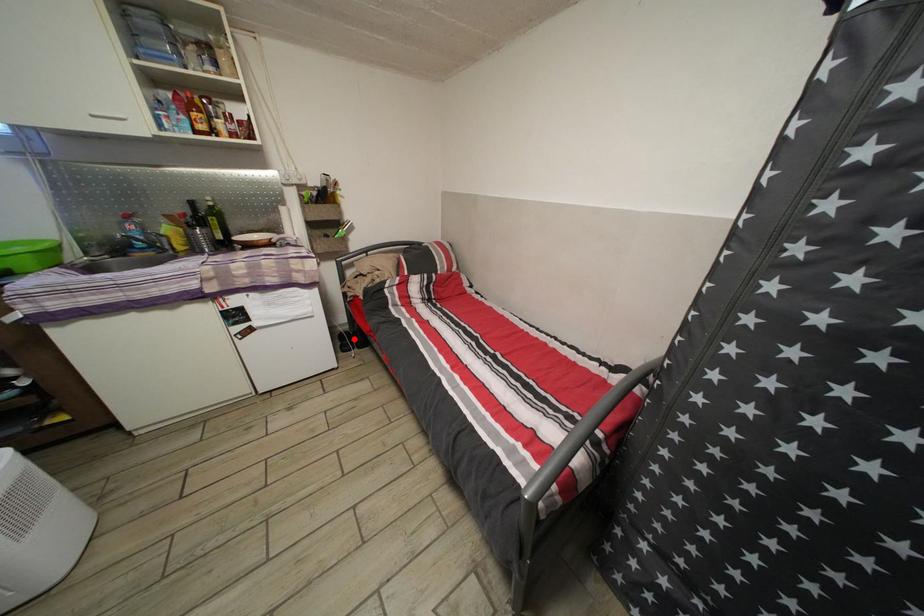
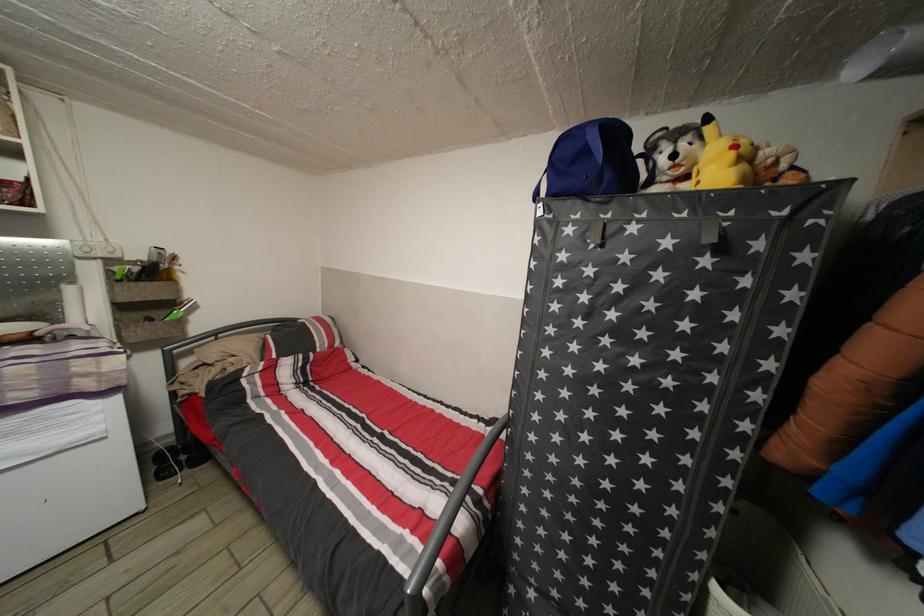
The point at the highlighted location is marked in the first image. Where is the corresponding point in the second image?

(177, 455)